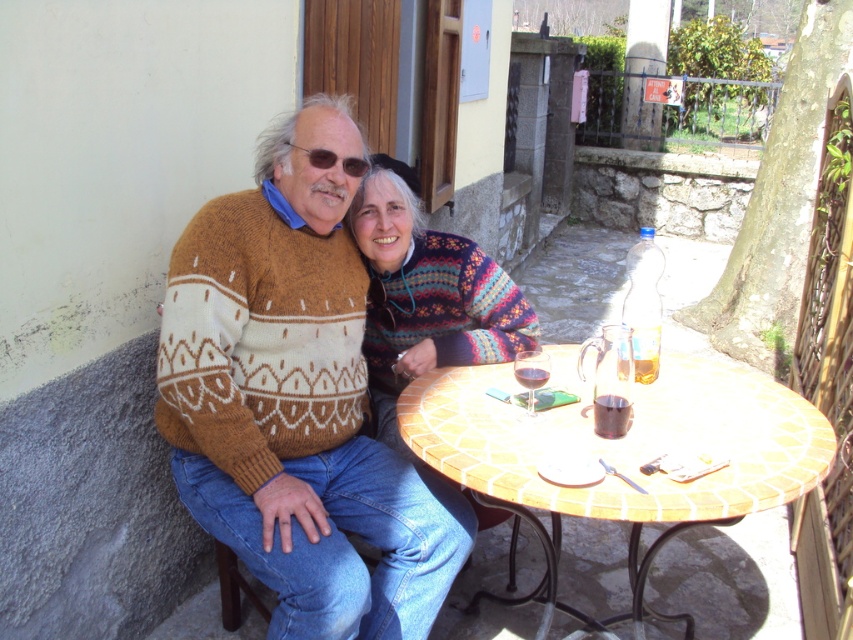
Question: Is terracotta mosaic table at center above multicolored knitted sweater at center?

Choices:
 (A) no
 (B) yes

Answer: (A)

Question: Considering the real-world distances, which object is closest to the translucent glass pitcher at table center?

Choices:
 (A) knitted sweater at left
 (B) translucent glass cup at table center
 (C) multicolored knitted sweater at center
 (D) terracotta mosaic table at center

Answer: (B)

Question: Which point is farther to the camera?

Choices:
 (A) translucent glass pitcher at table center
 (B) multicolored knitted sweater at center
 (C) knitted sweater at left

Answer: (B)

Question: Does terracotta mosaic table at center appear over multicolored knitted sweater at center?

Choices:
 (A) yes
 (B) no

Answer: (B)

Question: Estimate the real-world distances between objects in this image. Which object is farther from the knitted sweater at left?

Choices:
 (A) translucent glass cup at table center
 (B) multicolored knitted sweater at center

Answer: (A)

Question: Does terracotta mosaic table at center appear under multicolored knitted sweater at center?

Choices:
 (A) no
 (B) yes

Answer: (B)